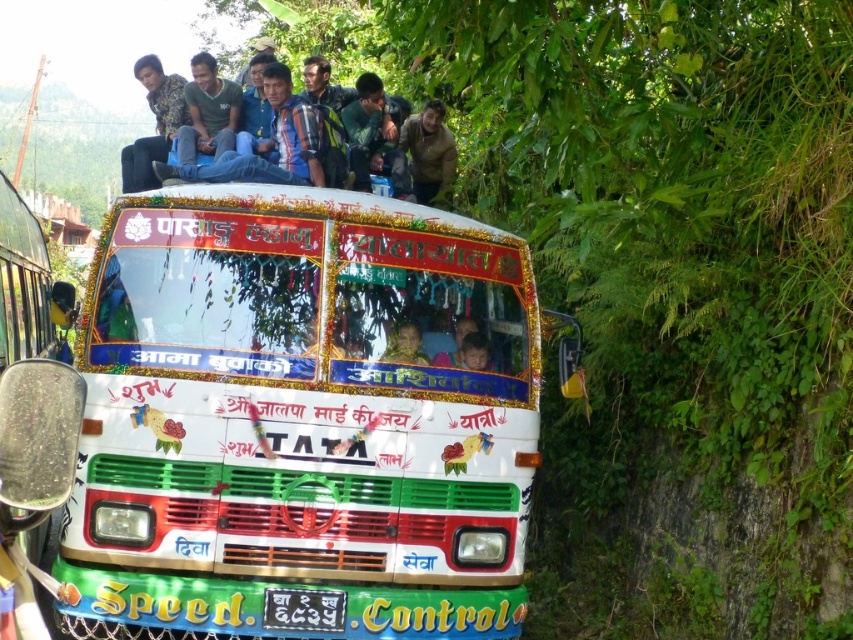
You are a delivery drone that needs to deliver a package to the golden fabric headscarf at center. The drone has a minimum safe distance requirement of 50 centimeters to avoid collisions. Can the drone safely hover at the current position near the white glossy bus at center to drop the package?

The distance between the white glossy bus at center and the golden fabric headscarf at center is 66.14 centimeters, which exceeds the drone minimum safe distance requirement of 50 centimeters. Therefore, the drone can safely hover at the current position near the white glossy bus at center to drop the package without violating the safety distance.

You are a photographer trying to capture the blue denim jeans at upper center and the matte blue jeans at upper center in the same frame. Which pair of jeans will appear bigger in your photo?

The blue denim jeans at upper center will appear bigger in the photo because it is larger in size than the matte blue jeans at upper center.

You are a drone operator trying to capture aerial footage of the white glossy bus at center. According to the coordinates provided, where should you position the drone to ensure the bus is centered in your shot?

The white glossy bus at center is located at coordinates point (302, 419), so you should position the drone at those coordinates to center it in your shot.